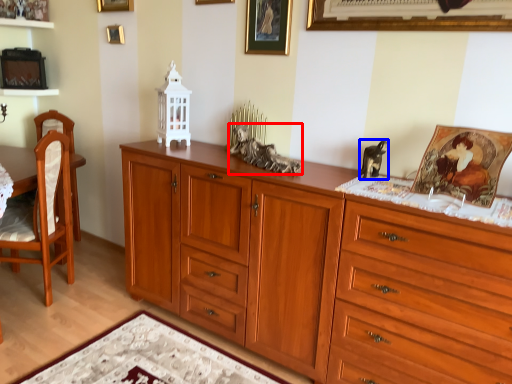
Question: Among these objects, which one is nearest to the camera, animal (highlighted by a red box) or animal (highlighted by a blue box)?

Choices:
 (A) animal
 (B) animal

Answer: (B)